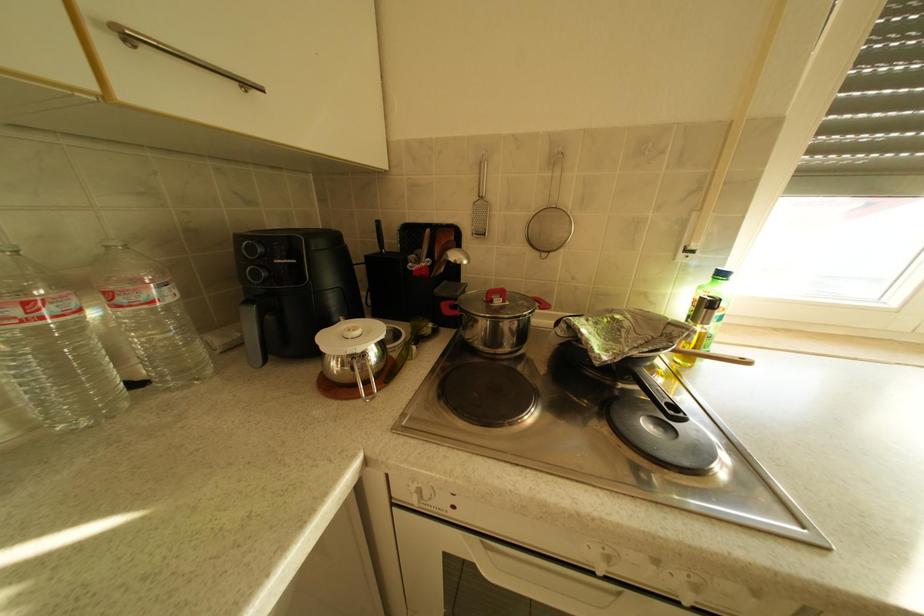
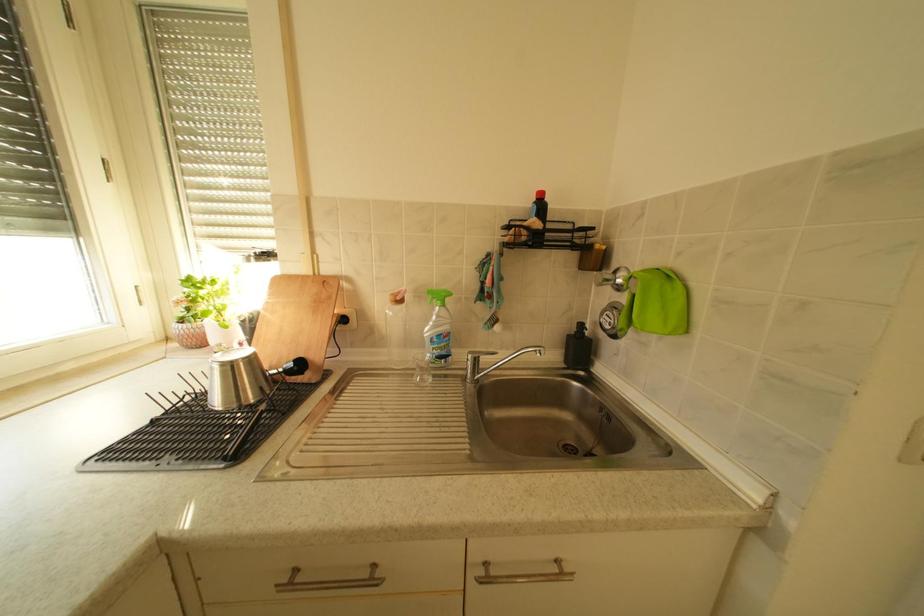
How did the camera likely rotate?

The rotation direction of the camera is right-down.